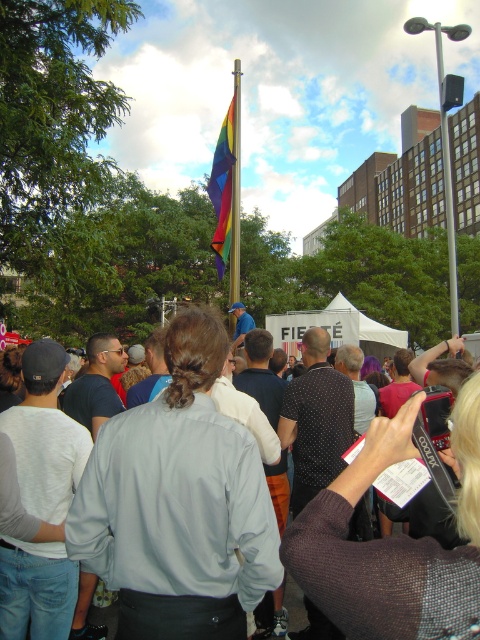
You are standing at the event and want to take a photo of the rainbow fabric flag at center. If your camera has a maximum focus range of 60 feet, will you be able to capture the flag clearly?

The rainbow fabric flag at center is 62.84 feet away from the viewer. Since the camera can only focus up to 60 feet, it won

You are a photographer at the event and want to capture both the gray fabric crowd at center and the rainbow fabric flag at center in a single frame. Which object should you focus on first to ensure both are in the frame?

The gray fabric crowd at center has a smaller size compared to the rainbow fabric flag at center, so you should focus on the rainbow fabric flag at center first to ensure both fit in the frame.